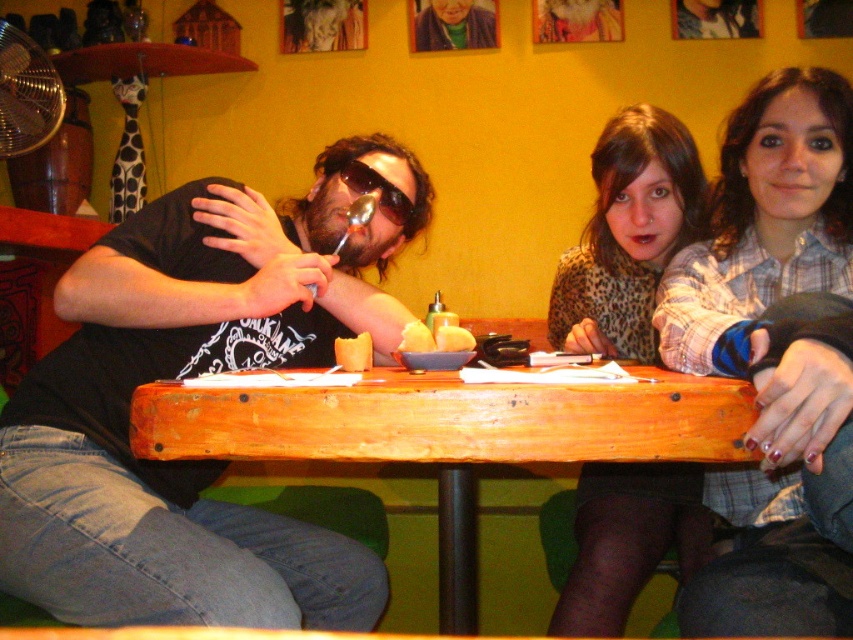
You are a customer sitting at the table and want to reach both the point at coordinates point (801, 620) and the point at coordinates point (346, 353). Which point will require you to reach further away from your current position?

The point at coordinates point (346, 353) will require reaching further away because it is farther from the viewer compared to point (801, 620).

You are a server in the restaurant and need to place a new menu on the table. The menu is 12 inches wide. There is a plaid shirt at center and an orange matte cupcake at center on the table. Can you fit the menu between them without moving either item?

The plaid shirt at center is wider than the orange matte cupcake at center. Since the menu is 12 inches wide, you need to ensure there is enough space between them. However, without knowing the exact distance between the two items, it is impossible to determine if the menu will fit. Please check the spacing between the plaid shirt at center and the orange matte cupcake at center first.

You are a customer at this cozy restaurant and you see both the plaid shirt at center and the leopard print sweater at center on the back of a chair. You want to take one of them to the coatroom. Which one is on top so you can grab it easily?

The plaid shirt at center is positioned over the leopard print sweater at center, so you can grab the plaid shirt at center easily.